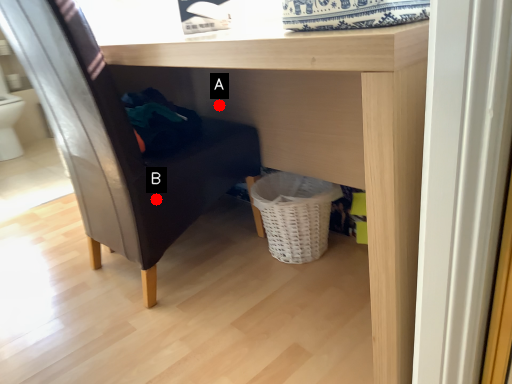
Question: Two points are circled on the image, labeled by A and B beside each circle. Which point is closer to the camera?

Choices:
 (A) A is closer
 (B) B is closer

Answer: (B)